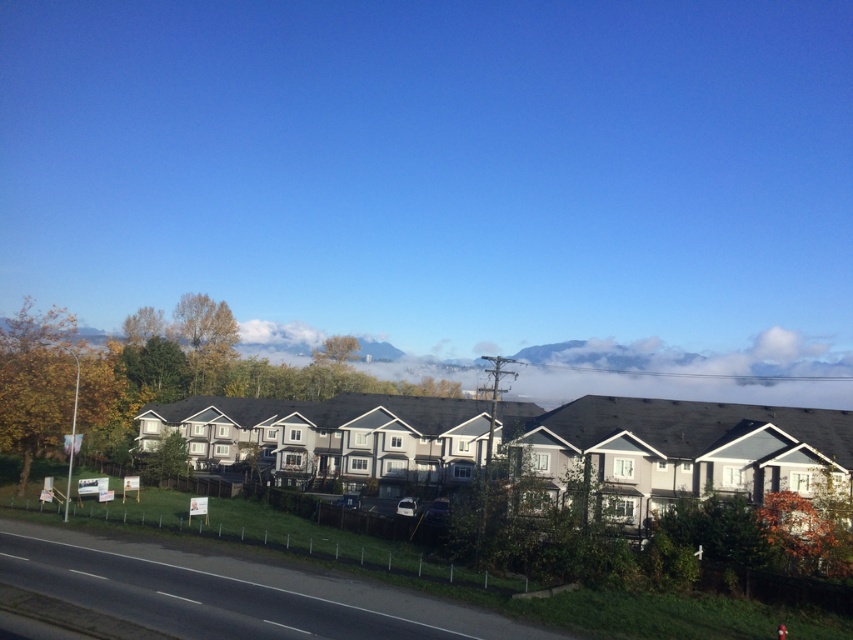
Question: Does black asphalt road at lower left have a larger size compared to green grass at lower left?

Choices:
 (A) yes
 (B) no

Answer: (B)

Question: Which object appears closest to the camera in this image?

Choices:
 (A) green grass at lower left
 (B) black asphalt road at lower left

Answer: (B)

Question: Which point is closer to the camera taking this photo?

Choices:
 (A) (291, 520)
 (B) (171, 609)

Answer: (B)

Question: Does black asphalt road at lower left appear under green grass at lower left?

Choices:
 (A) yes
 (B) no

Answer: (B)

Question: Which point appears farthest from the camera in this image?

Choices:
 (A) (167, 609)
 (B) (410, 561)

Answer: (B)

Question: Does black asphalt road at lower left appear over green grass at lower left?

Choices:
 (A) yes
 (B) no

Answer: (A)